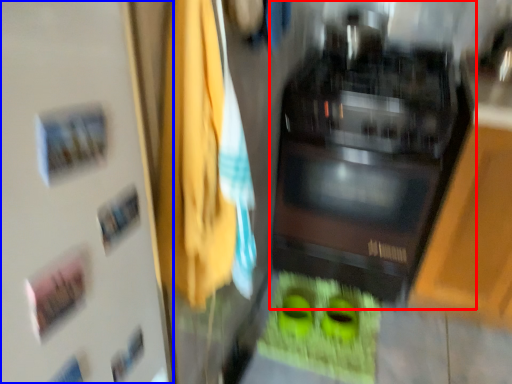
Question: Which object appears farthest to the camera in this image, home appliance (highlighted by a red box) or door (highlighted by a blue box)?

Choices:
 (A) home appliance
 (B) door

Answer: (A)